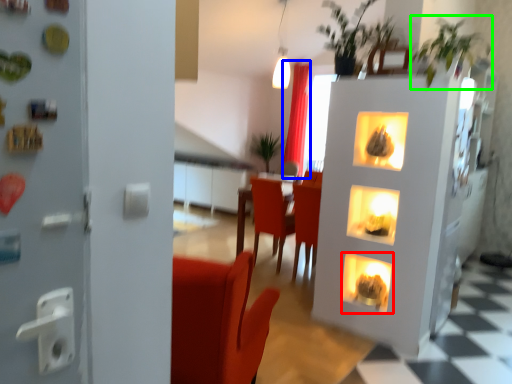
Question: Estimate the real-world distances between objects in this image. Which object is closer to fireplace (highlighted by a red box), curtain (highlighted by a blue box) or plant (highlighted by a green box)?

Choices:
 (A) curtain
 (B) plant

Answer: (B)